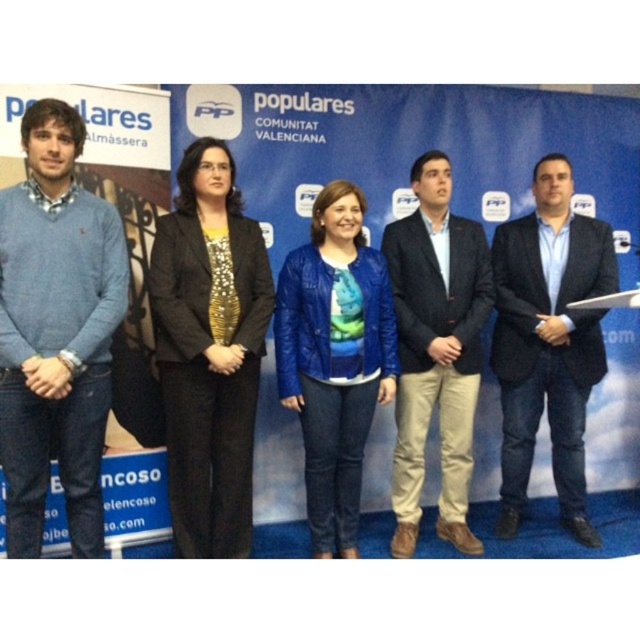
Question: Can you confirm if matte blue sweater at left is wider than black sequined blazer at center?

Choices:
 (A) no
 (B) yes

Answer: (A)

Question: Among these points, which one is nearest to the camera?

Choices:
 (A) (600, 365)
 (B) (253, 220)
 (C) (108, 259)

Answer: (C)

Question: Which object is closer to the camera taking this photo?

Choices:
 (A) blue leather jacket at center
 (B) dark brown leather jacket at center
 (C) black sequined blazer at center

Answer: (C)

Question: Is blue denim jeans at center to the right of blue leather jacket at center from the viewer's perspective?

Choices:
 (A) yes
 (B) no

Answer: (A)

Question: Which is nearer to the blue denim jeans at center?

Choices:
 (A) dark brown leather jacket at center
 (B) blue leather jacket at center
 (C) matte blue sweater at left

Answer: (A)

Question: Does blue denim jeans at center appear on the right side of blue leather jacket at center?

Choices:
 (A) no
 (B) yes

Answer: (B)